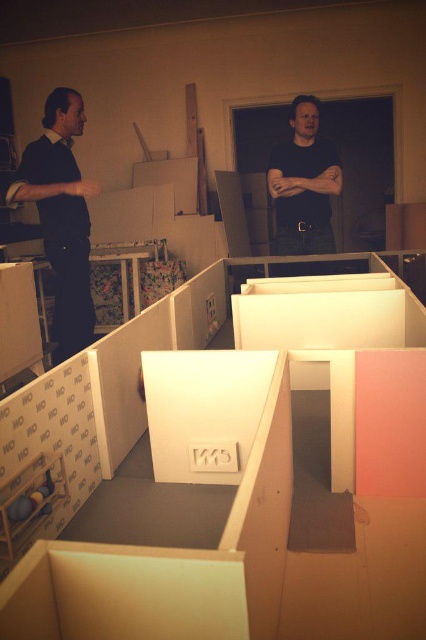
Is point (66, 336) less distant than point (339, 188)?

No, it is not.

Who is taller, matte black shirt at left or dark gray shirt at center?

matte black shirt at left is taller.

Who is more forward, (78, 196) or (325, 170)?

Positioned in front is point (78, 196).

In order to click on matte black shirt at left in this screenshot , I will do click(62, 216).